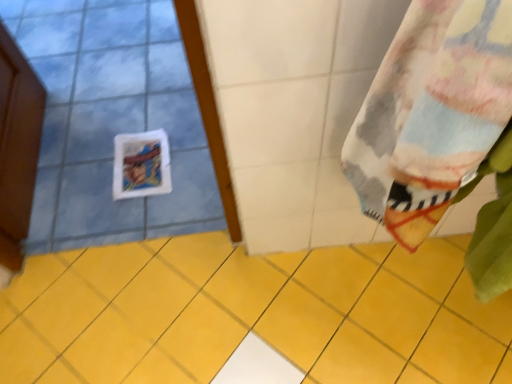
Locate an element on the screen. yellow ceramic tile at center is located at coordinates (252, 314).

The height and width of the screenshot is (384, 512). What do you see at coordinates (252, 314) in the screenshot?
I see `yellow ceramic tile at center` at bounding box center [252, 314].

Locate an element on the screen. fluffy multicolored towel at right is located at coordinates (431, 112).

Describe the element at coordinates (431, 112) in the screenshot. I see `fluffy multicolored towel at right` at that location.

Image resolution: width=512 pixels, height=384 pixels. I want to click on yellow ceramic tile at center, so click(x=252, y=314).

Which is more to the right, fluffy multicolored towel at right or yellow ceramic tile at center?

Positioned to the right is fluffy multicolored towel at right.

Considering the positions of objects fluffy multicolored towel at right and yellow ceramic tile at center in the image provided, who is in front, fluffy multicolored towel at right or yellow ceramic tile at center?

fluffy multicolored towel at right is in front.

Which is closer, (460, 80) or (188, 351)?

The point (460, 80) is in front.

From the image's perspective, is fluffy multicolored towel at right located beneath yellow ceramic tile at center?

Actually, fluffy multicolored towel at right appears above yellow ceramic tile at center in the image.

From a real-world perspective, is fluffy multicolored towel at right above or below yellow ceramic tile at center?

Clearly, from a real-world perspective, fluffy multicolored towel at right is above yellow ceramic tile at center.

Consider the image. Which of these two, fluffy multicolored towel at right or yellow ceramic tile at center, is thinner?

Thinner between the two is fluffy multicolored towel at right.

Considering the sizes of fluffy multicolored towel at right and yellow ceramic tile at center in the image, is fluffy multicolored towel at right taller or shorter than yellow ceramic tile at center?

fluffy multicolored towel at right is taller than yellow ceramic tile at center.

Which of these two, fluffy multicolored towel at right or yellow ceramic tile at center, is smaller?

yellow ceramic tile at center.

Which is correct: fluffy multicolored towel at right is inside yellow ceramic tile at center, or outside of it?

fluffy multicolored towel at right is spatially situated outside yellow ceramic tile at center.

Are fluffy multicolored towel at right and yellow ceramic tile at center located far from each other?

No, fluffy multicolored towel at right is not far away from yellow ceramic tile at center.

Is fluffy multicolored towel at right turned away from yellow ceramic tile at center?

No, yellow ceramic tile at center is not at the back of fluffy multicolored towel at right.

In the scene shown: What's the angular difference between fluffy multicolored towel at right and yellow ceramic tile at center's facing directions?

They differ by 178 degrees in their facing directions.

How far apart are fluffy multicolored towel at right and yellow ceramic tile at center?

fluffy multicolored towel at right and yellow ceramic tile at center are 29.33 inches apart.

Find the location of `ceramic tile lying below the fluffy multicolored towel at right (from the image's perspective)`. ceramic tile lying below the fluffy multicolored towel at right (from the image's perspective) is located at coordinates (252, 314).

Is yellow ceramic tile at center to the right of fluffy multicolored towel at right from the viewer's perspective?

Incorrect, yellow ceramic tile at center is not on the right side of fluffy multicolored towel at right.

Considering the positions of objects yellow ceramic tile at center and fluffy multicolored towel at right in the image provided, who is behind, yellow ceramic tile at center or fluffy multicolored towel at right?

yellow ceramic tile at center is further away from the camera.

Which is nearer, (178, 347) or (416, 215)?

Point (416, 215)

In the scene shown: From the image's perspective, is yellow ceramic tile at center on top of fluffy multicolored towel at right?

No, from the image's perspective, yellow ceramic tile at center is not above fluffy multicolored towel at right.

From a real-world perspective, relative to fluffy multicolored towel at right, is yellow ceramic tile at center vertically above or below?

From a real-world perspective, yellow ceramic tile at center is physically below fluffy multicolored towel at right.

Considering the relative sizes of yellow ceramic tile at center and fluffy multicolored towel at right in the image provided, is yellow ceramic tile at center thinner than fluffy multicolored towel at right?

In fact, yellow ceramic tile at center might be wider than fluffy multicolored towel at right.

Considering the relative sizes of yellow ceramic tile at center and fluffy multicolored towel at right in the image provided, is yellow ceramic tile at center shorter than fluffy multicolored towel at right?

Yes.

Considering the sizes of objects yellow ceramic tile at center and fluffy multicolored towel at right in the image provided, who is smaller, yellow ceramic tile at center or fluffy multicolored towel at right?

yellow ceramic tile at center is smaller.

Is fluffy multicolored towel at right surrounded by yellow ceramic tile at center?

Definitely not — fluffy multicolored towel at right is not inside yellow ceramic tile at center.

Is yellow ceramic tile at center beside fluffy multicolored towel at right?

No, yellow ceramic tile at center is not in contact with fluffy multicolored towel at right.

Is yellow ceramic tile at center turned away from fluffy multicolored towel at right?

No, yellow ceramic tile at center's orientation is not away from fluffy multicolored towel at right.

Can you tell me how much yellow ceramic tile at center and fluffy multicolored towel at right differ in facing direction?

The angle between the facing direction of yellow ceramic tile at center and the facing direction of fluffy multicolored towel at right is 178 degrees.

Locate an element on the screen. Image resolution: width=512 pixels, height=384 pixels. curtain above the yellow ceramic tile at center (from a real-world perspective) is located at coordinates (431, 112).

You are a GUI agent. You are given a task and a screenshot of the screen. Output one action in this format:
    pyautogui.click(x=<x>, y=<y>)
    Task: Click on the ceramic tile behind the fluffy multicolored towel at right
    This screenshot has height=384, width=512.
    Given the screenshot: What is the action you would take?
    pyautogui.click(x=252, y=314)

In order to click on curtain above the yellow ceramic tile at center (from the image's perspective) in this screenshot , I will do `click(431, 112)`.